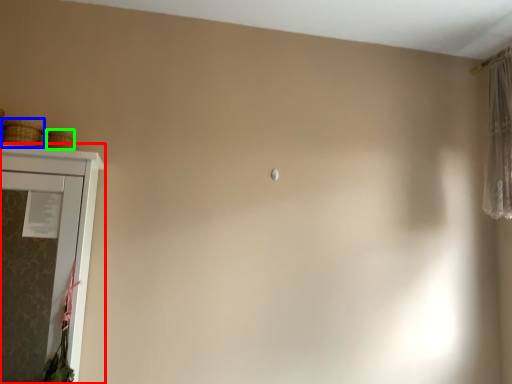
Question: Which object is the farthest from cupboard (highlighted by a red box)? Choose among these: basket (highlighted by a blue box) or basket (highlighted by a green box).

Choices:
 (A) basket
 (B) basket

Answer: (B)